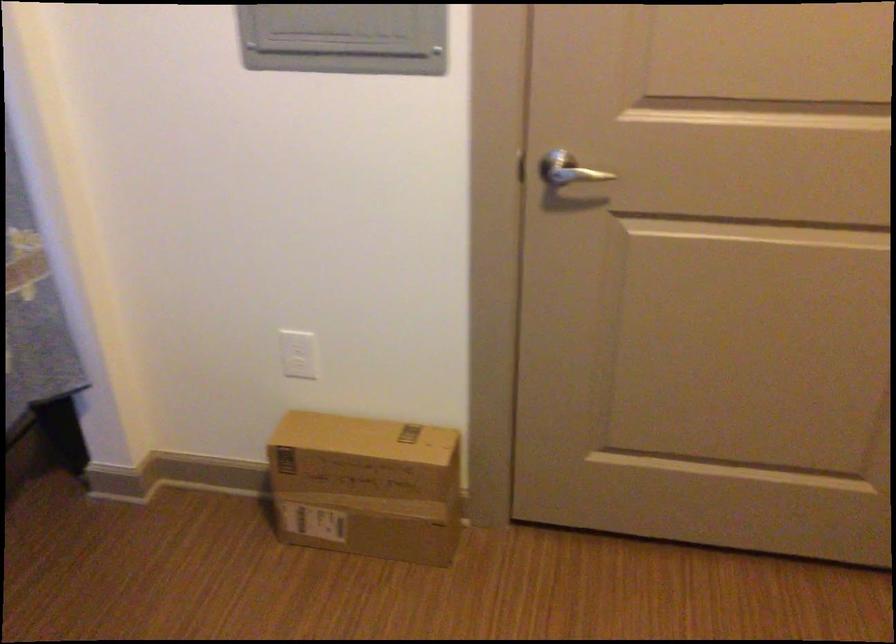
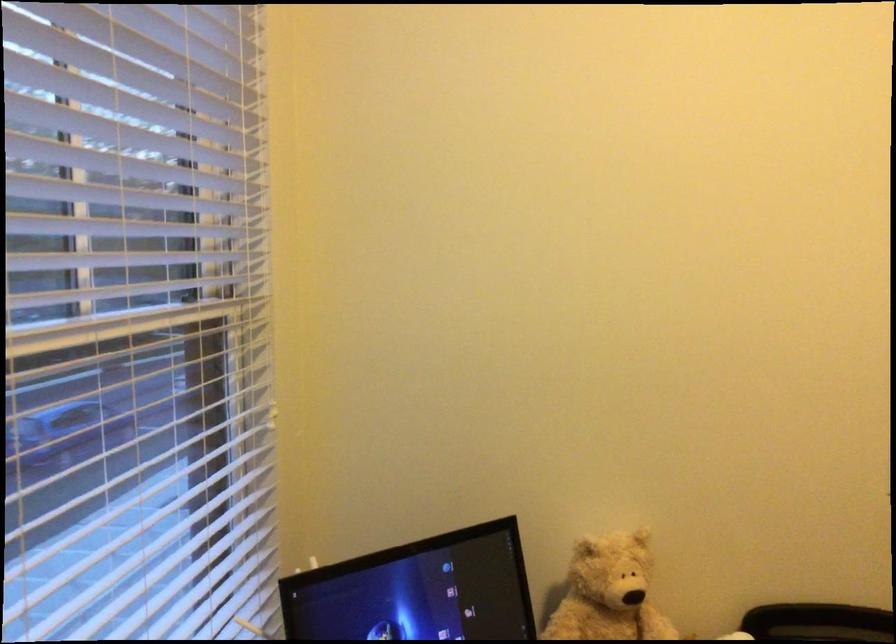
Question: How did the camera likely rotate?

Choices:
 (A) Left
 (B) Right
 (C) Up
 (D) Down

Answer: (A)